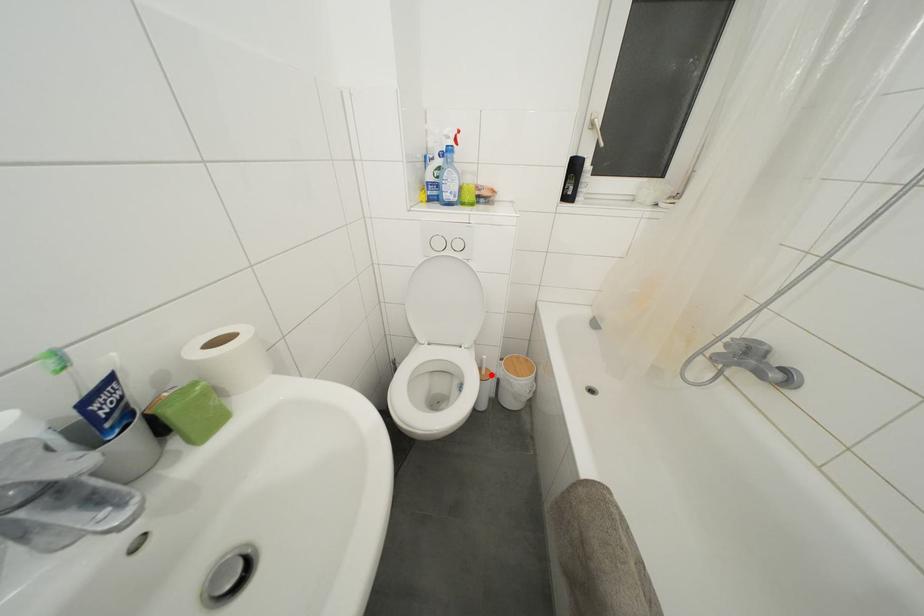
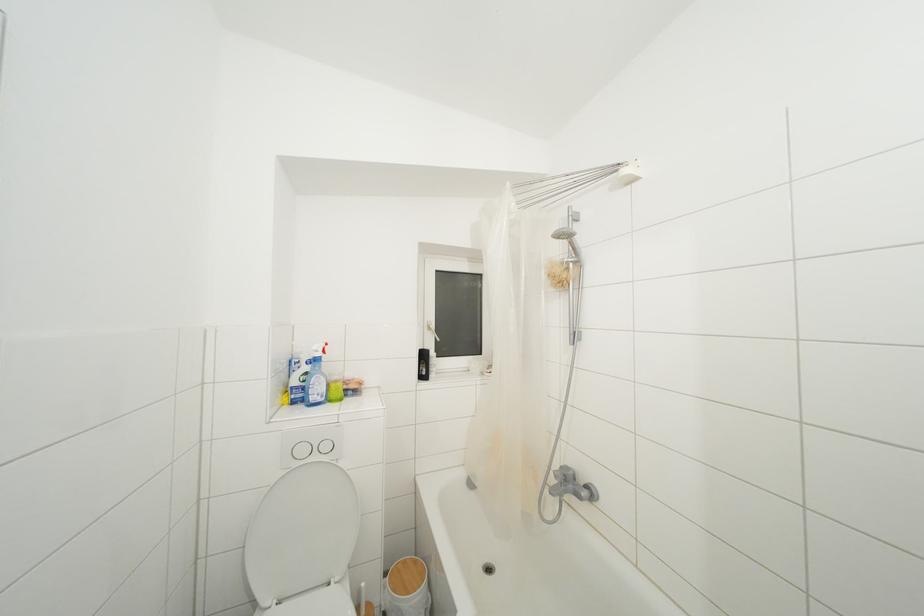
Locate, in the second image, the point that corresponds to the highlighted location in the first image.

(371, 610)